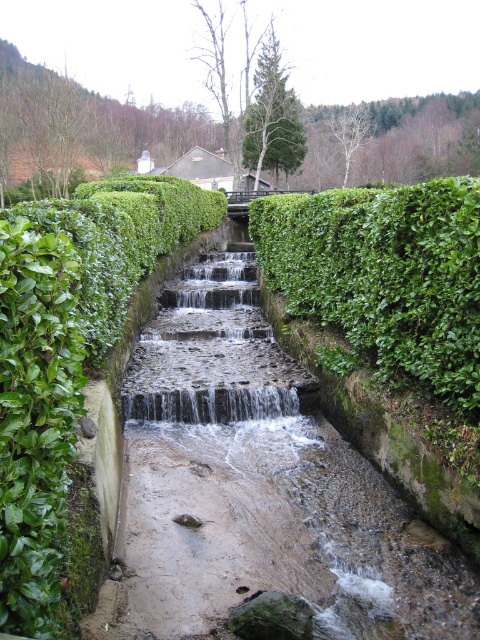
Question: Is smooth stone steps at center smaller than clear water at center?

Choices:
 (A) no
 (B) yes

Answer: (A)

Question: Which point appears farthest from the camera in this image?

Choices:
 (A) (56, 410)
 (B) (278, 387)
 (C) (181, 406)
 (D) (415, 252)

Answer: (B)

Question: Does green leafy hedge at upper center come behind smooth stone steps at center?

Choices:
 (A) yes
 (B) no

Answer: (B)

Question: Which point is farther to the camera?

Choices:
 (A) (262, 385)
 (B) (217, 419)

Answer: (A)

Question: Which object is closer to the camera taking this photo?

Choices:
 (A) green leafy hedge at upper center
 (B) green leafy hedge at center
 (C) smooth stone steps at center
 (D) clear water at center

Answer: (B)

Question: Is green leafy hedge at center above clear water at center?

Choices:
 (A) yes
 (B) no

Answer: (A)